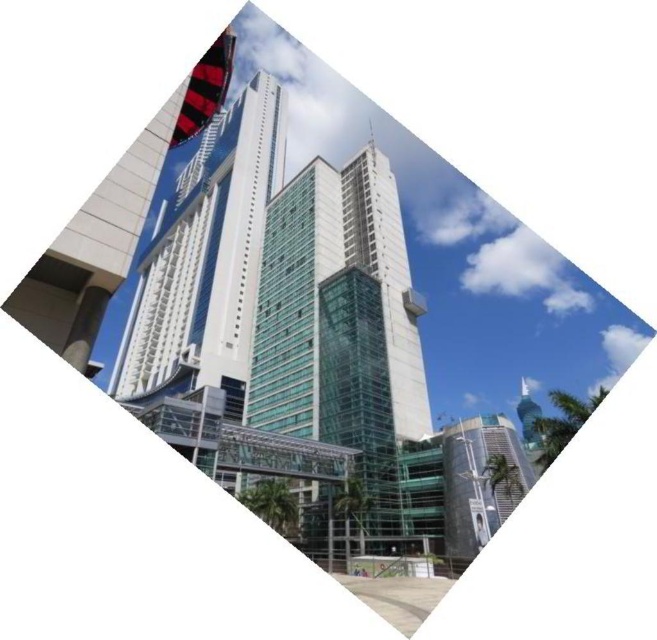
You are standing on the transparent walkway and looking up at the buildings. Which of the two structures, the transparent glass tower at center or the white glass building at center, is positioned higher in the sky?

The white glass building at center is positioned higher in the sky than the transparent glass tower at center because the transparent glass tower at center is below the white glass building at center.

You are standing at the entrance of the transparent glass tower at center. Which direction should you walk to reach the palm trees in the foreground?

The transparent glass tower at center is located at point (342, 336). Since the palm trees are in the foreground, you should walk forward towards them from the entrance of the transparent glass tower at center.

You are an architect evaluating the urban layout. Which of the two buildings, the white glass building at center or the glassy teal skyscraper at lower right, has a larger footprint in the cityscape?

The white glass building at center has a larger footprint in the cityscape as it is bigger than the glassy teal skyscraper at lower right.